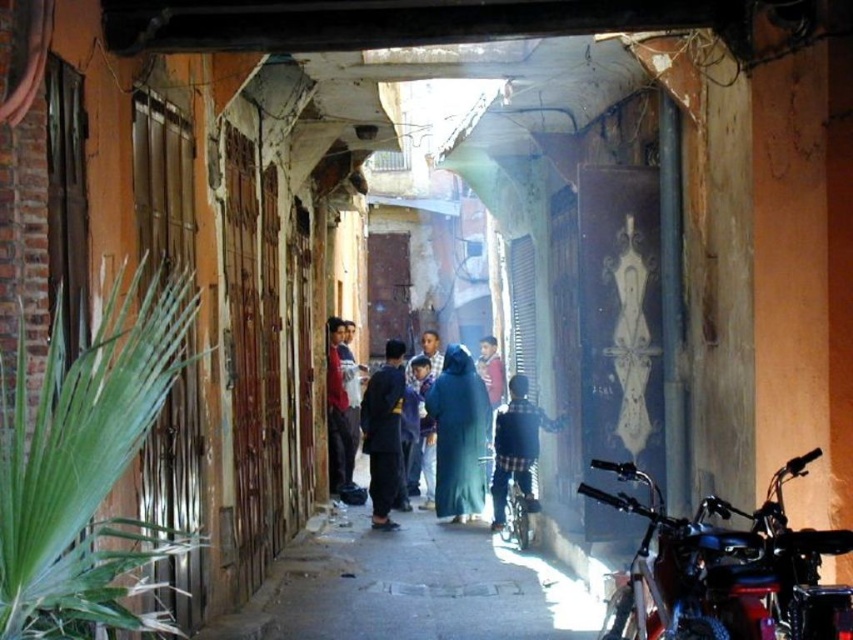
You are a photographer standing at the entrance of the alleyway. You want to capture a photo that includes both the blue fabric dress at center and the plaid fabric shirt at center. However, your camera has a limited zoom range. To ensure both subjects are in frame, which subject should you position closer to the camera?

The blue fabric dress at center is taller than the plaid fabric shirt at center. Since the blue fabric dress at center is taller, positioning it closer to the camera will help ensure both subjects are in frame without needing excessive zoom.

You are a photographer standing at the entrance of the alley. You want to take a photo of the blue fabric dress at center without the shiny black motorcycle at lower right appearing in the frame. Is this possible given their positions?

The shiny black motorcycle at lower right is located above the blue fabric dress at center, so if you position yourself lower or adjust your angle to avoid the motorcycle above, you can capture the blue fabric dress at center without the motorcycle in the frame.